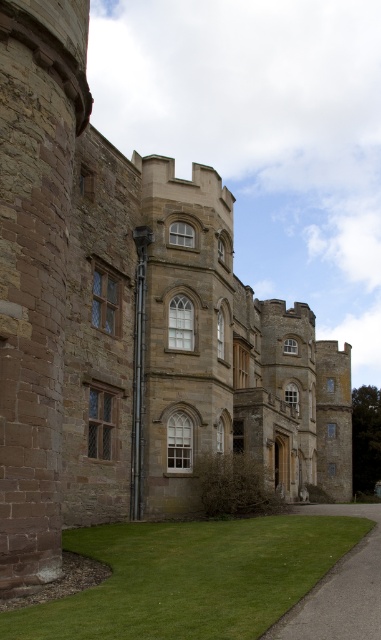
Question: Is green grass at lower center positioned before gray asphalt driveway at lower right?

Choices:
 (A) yes
 (B) no

Answer: (A)

Question: Is green grass at lower center to the right of gray asphalt driveway at lower right from the viewer's perspective?

Choices:
 (A) no
 (B) yes

Answer: (A)

Question: Does green grass at lower center lie in front of gray asphalt driveway at lower right?

Choices:
 (A) yes
 (B) no

Answer: (A)

Question: Among these points, which one is farthest from the camera?

Choices:
 (A) (256, 634)
 (B) (323, 586)

Answer: (B)